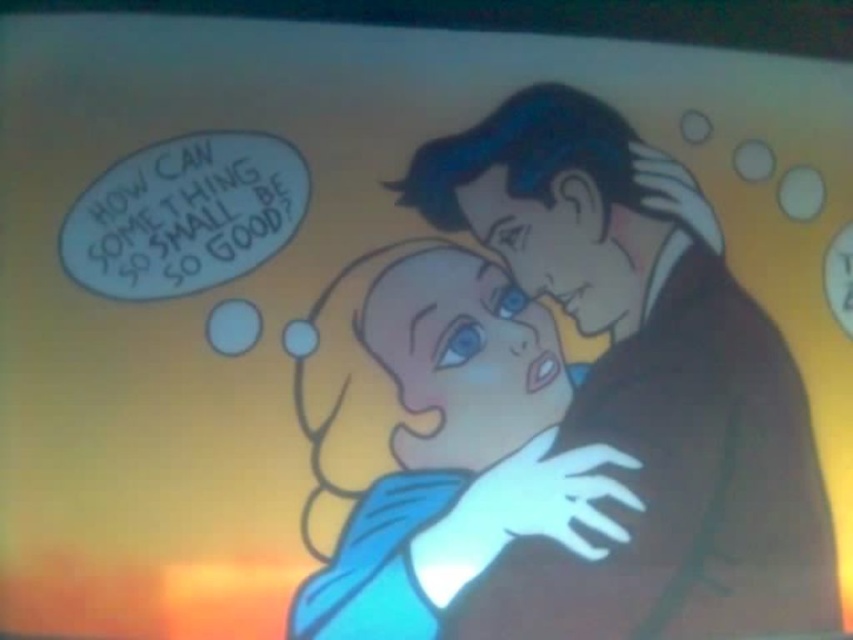
Who is positioned more to the left, smooth brown suit at center or blue fabric baby at center?

blue fabric baby at center

Is smooth brown suit at center in front of blue fabric baby at center?

That is False.

This screenshot has height=640, width=853. What do you see at coordinates (641, 385) in the screenshot?
I see `smooth brown suit at center` at bounding box center [641, 385].

Find the location of a particular element. This screenshot has height=640, width=853. smooth brown suit at center is located at coordinates [641, 385].